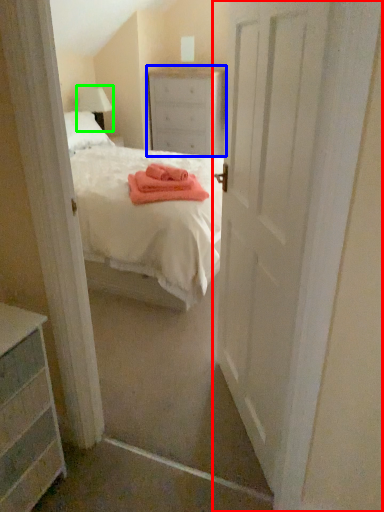
Question: Which object is positioned farthest from door (highlighted by a red box)? Select from nightstand (highlighted by a blue box) and lamp (highlighted by a green box).

Choices:
 (A) nightstand
 (B) lamp

Answer: (B)